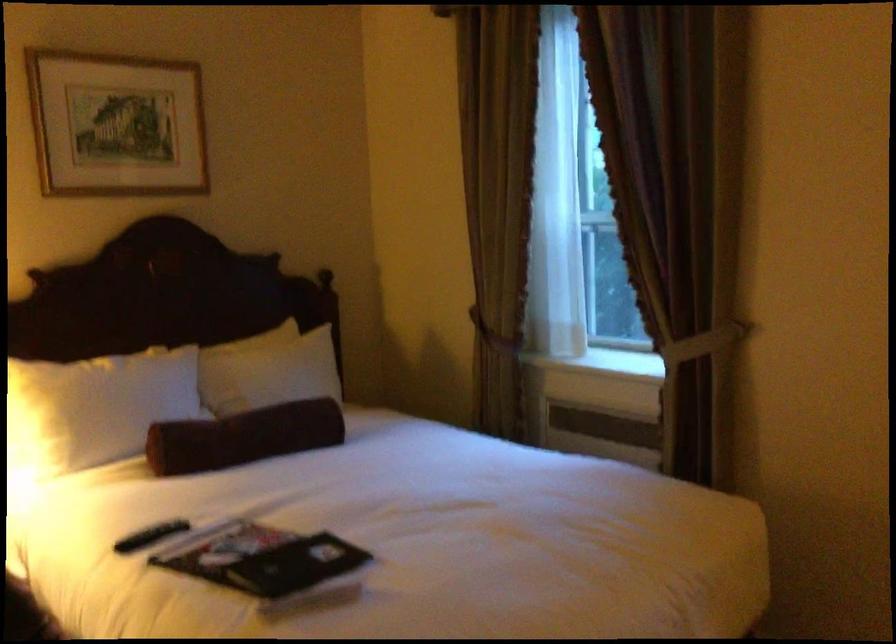
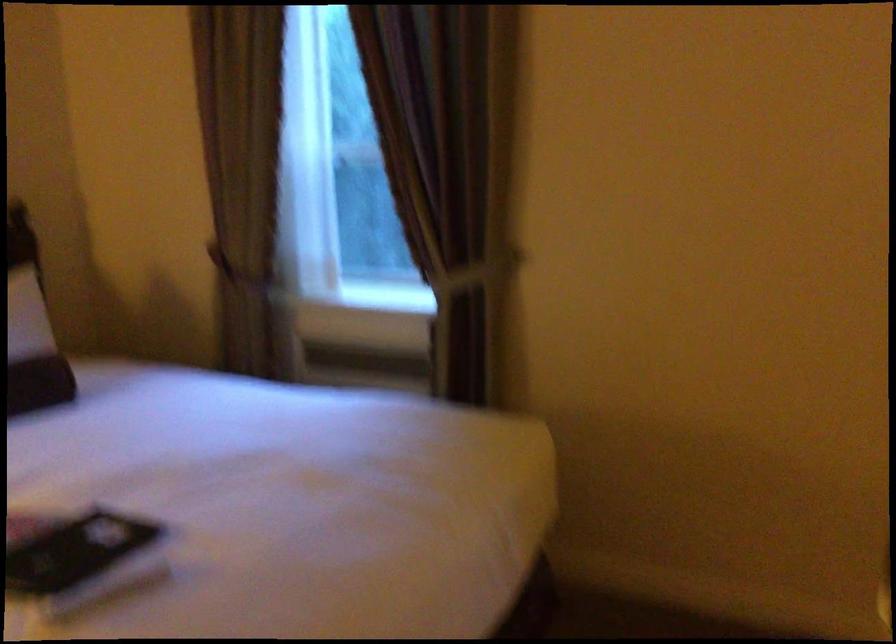
What movement of the cameraman would produce the second image?

The cameraman walked toward left, forward.